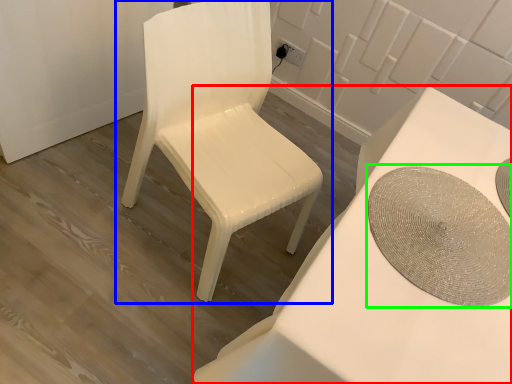
Question: Estimate the real-world distances between objects in this image. Which object is farther from table (highlighted by a red box), chair (highlighted by a blue box) or round table (highlighted by a green box)?

Choices:
 (A) chair
 (B) round table

Answer: (A)